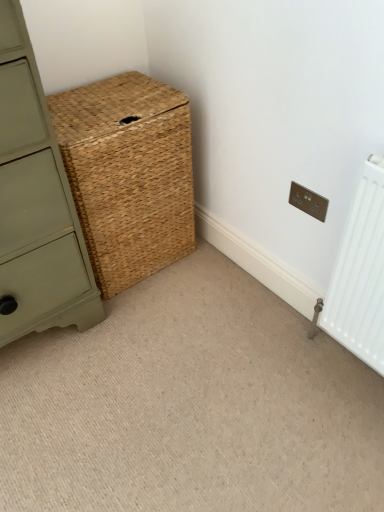
Question: Would you say matte green chest of drawers at center-left contains natural woven basket at center?

Choices:
 (A) no
 (B) yes

Answer: (A)

Question: Does matte green chest of drawers at center-left appear on the right side of natural woven basket at center?

Choices:
 (A) no
 (B) yes

Answer: (A)

Question: Is matte green chest of drawers at center-left at the left side of natural woven basket at center?

Choices:
 (A) yes
 (B) no

Answer: (A)

Question: Is matte green chest of drawers at center-left positioned with its back to natural woven basket at center?

Choices:
 (A) yes
 (B) no

Answer: (B)

Question: Is matte green chest of drawers at center-left taller than natural woven basket at center?

Choices:
 (A) no
 (B) yes

Answer: (B)

Question: Is the position of matte green chest of drawers at center-left more distant than that of natural woven basket at center?

Choices:
 (A) yes
 (B) no

Answer: (B)

Question: Does matte silver electric outlet at upper right have a greater height compared to matte green chest of drawers at center-left?

Choices:
 (A) no
 (B) yes

Answer: (A)

Question: Are matte silver electric outlet at upper right and matte green chest of drawers at center-left beside each other?

Choices:
 (A) yes
 (B) no

Answer: (B)

Question: Is matte silver electric outlet at upper right positioned behind matte green chest of drawers at center-left?

Choices:
 (A) no
 (B) yes

Answer: (B)

Question: Is matte silver electric outlet at upper right positioned far away from matte green chest of drawers at center-left?

Choices:
 (A) yes
 (B) no

Answer: (B)

Question: From a real-world perspective, is matte silver electric outlet at upper right below matte green chest of drawers at center-left?

Choices:
 (A) yes
 (B) no

Answer: (A)

Question: Can you confirm if matte silver electric outlet at upper right is wider than matte green chest of drawers at center-left?

Choices:
 (A) yes
 (B) no

Answer: (B)

Question: From a real-world perspective, is natural woven basket at center physically above matte green chest of drawers at center-left?

Choices:
 (A) yes
 (B) no

Answer: (B)